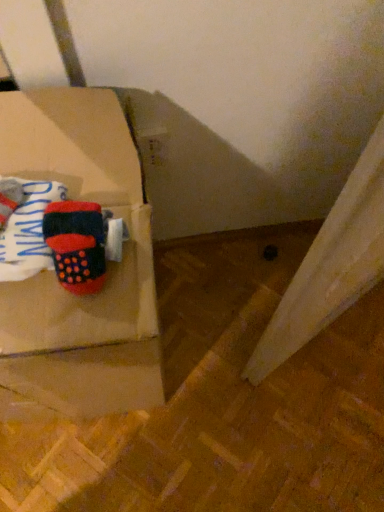
Image resolution: width=384 pixels, height=512 pixels. I want to click on vacant space to the right of matte cardboard box at left, so click(x=226, y=361).